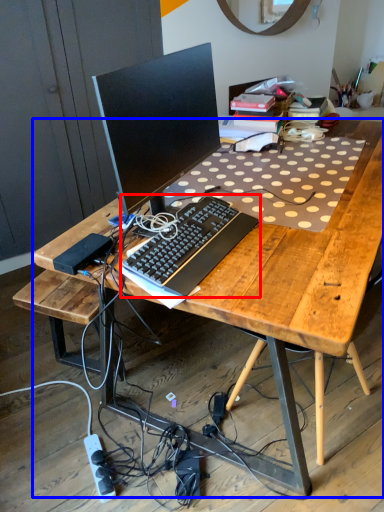
Question: Which of the following is the closest to the observer, computer keyboard (highlighted by a red box) or desk (highlighted by a blue box)?

Choices:
 (A) computer keyboard
 (B) desk

Answer: (B)